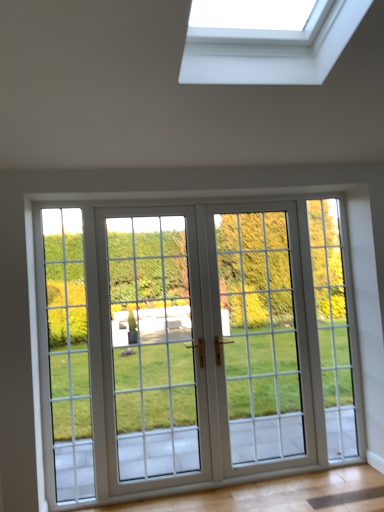
Identify the location of clear glass door at left. (68, 353).

Describe the element at coordinates (68, 353) in the screenshot. I see `clear glass door at left` at that location.

The width and height of the screenshot is (384, 512). Identify the location of clear glass door at left. (68, 353).